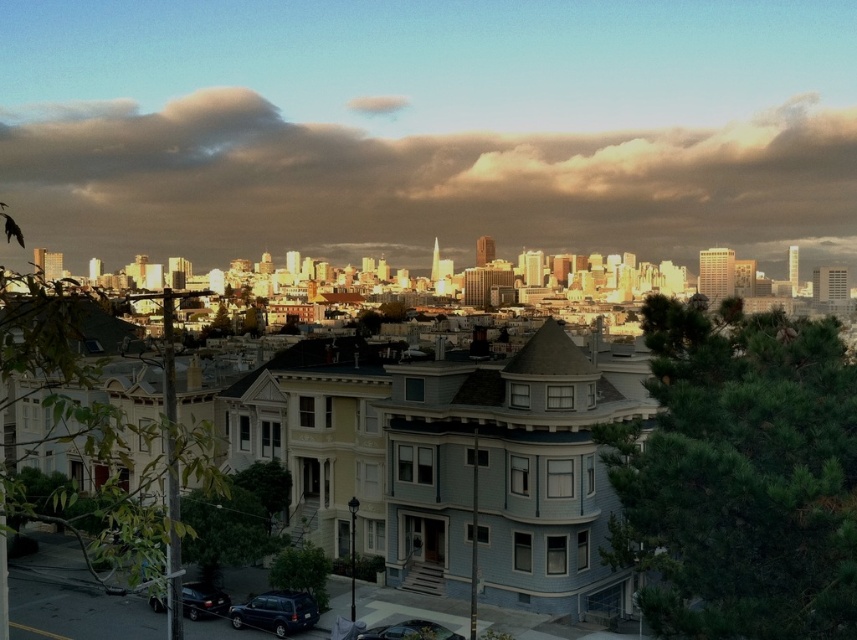
You are a pedestrian standing at the edge of the road and want to cross to the other side. You see a matte black suv at lower left and a shiny black sedan at lower left. Which vehicle is closer to you?

The matte black suv at lower left is closer to you because it is further to the viewer than the shiny black sedan at lower left, meaning it appears nearer in the scene.

You are a delivery driver who needs to park your metallic silver car at lower center next to the shiny black sedan at lower left. Is there enough space between them to open both doors without any obstruction?

The shiny black sedan at lower left is larger than the metallic silver car at lower center. Since the shiny black sedan at lower left is bigger, there might not be enough space between them to open both doors safely. It would be better to park further apart to avoid collisions when opening doors.